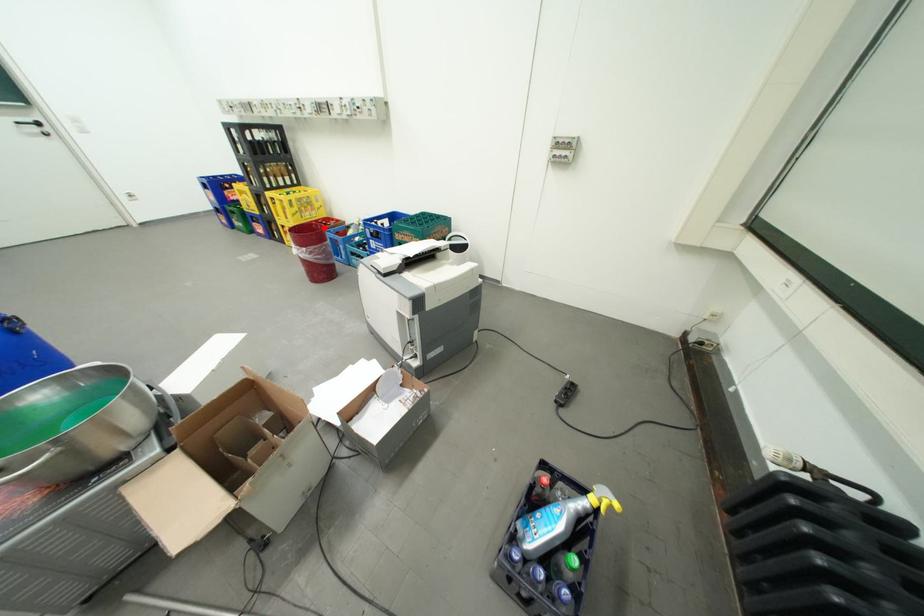
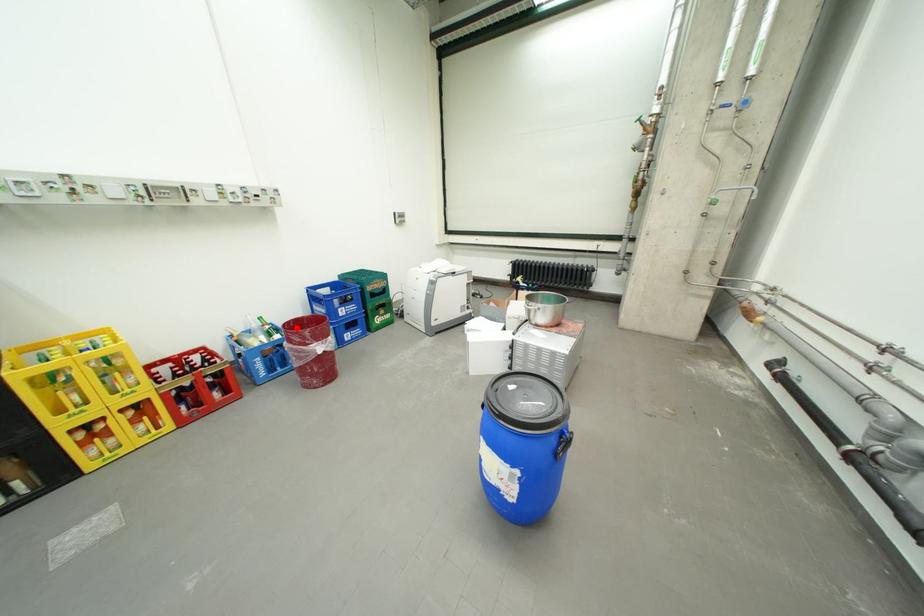
I am providing you with two images of the same scene from different viewpoints. A red point is marked on the first image and another point is marked on the second image. Does the point marked in image1 correspond to the same location as the one in image2?

Yes